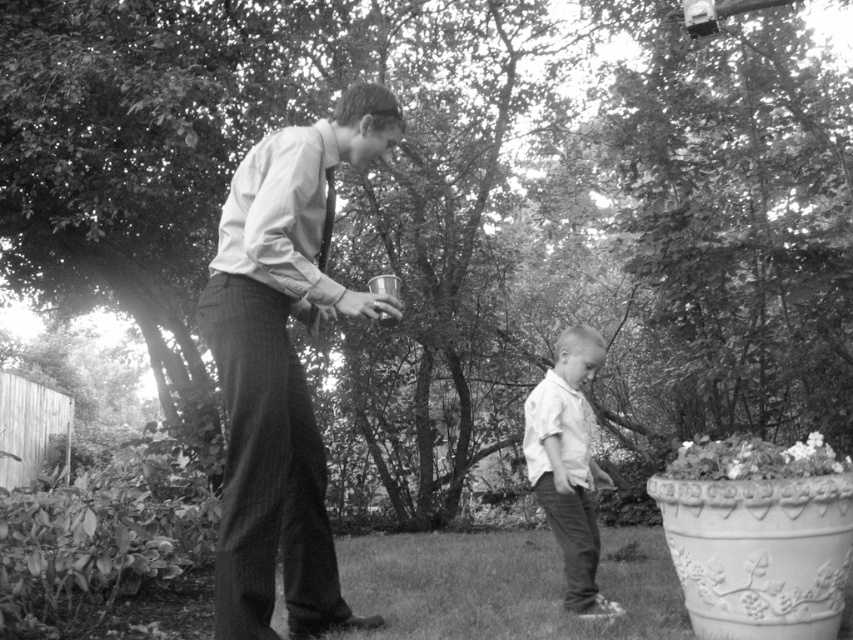
Question: Which object is farther from the camera taking this photo?

Choices:
 (A) matte white shirt at center
 (B) white smooth shirt at center

Answer: (B)

Question: Does matte white shirt at center appear on the left side of white smooth shirt at center?

Choices:
 (A) yes
 (B) no

Answer: (A)

Question: Is matte white shirt at center behind white smooth shirt at center?

Choices:
 (A) no
 (B) yes

Answer: (A)

Question: Does matte white shirt at center appear on the right side of white smooth shirt at center?

Choices:
 (A) yes
 (B) no

Answer: (B)

Question: Among these objects, which one is nearest to the camera?

Choices:
 (A) white smooth shirt at center
 (B) matte white shirt at center

Answer: (B)